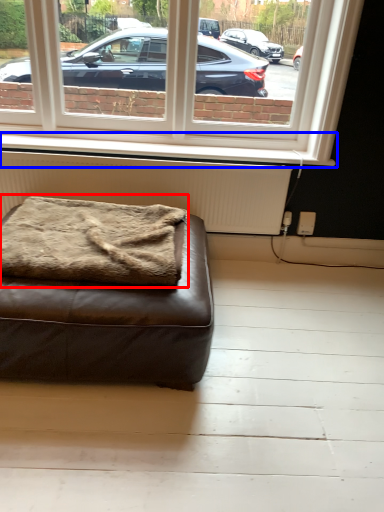
Question: Which object is closer to the camera taking this photo, blanket (highlighted by a red box) or window sill (highlighted by a blue box)?

Choices:
 (A) blanket
 (B) window sill

Answer: (A)